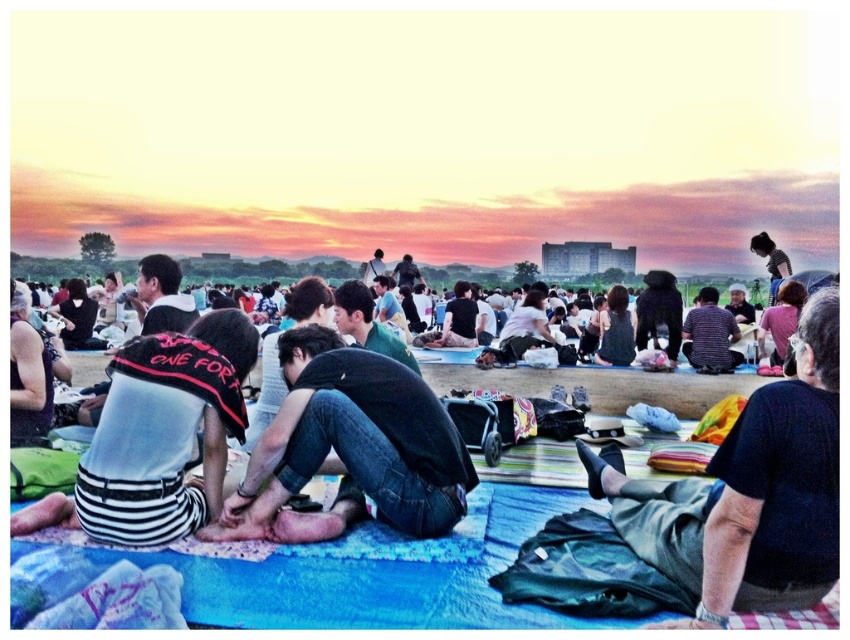
You are at the gathering and want to take a photo of the denim jeans at center and the black striped shirt at center. Which one should you focus on first if you want to capture both in the same frame without moving the camera?

The denim jeans at center should be focused on first since it is positioned under the black striped shirt at center, meaning it is lower in the frame and thus would be in the foreground. By focusing on the foreground object first, both items can be captured in the same frame without moving the camera.

You are a photographer standing at the edge of the gathering, and you want to take a photo that includes both the dark gray pants at center and denim jeans at center. Which of the two should you focus on first if you want to ensure both are in frame?

The dark gray pants at center is much taller than denim jeans at center, so you should focus on the dark gray pants at center first to ensure both are in frame.